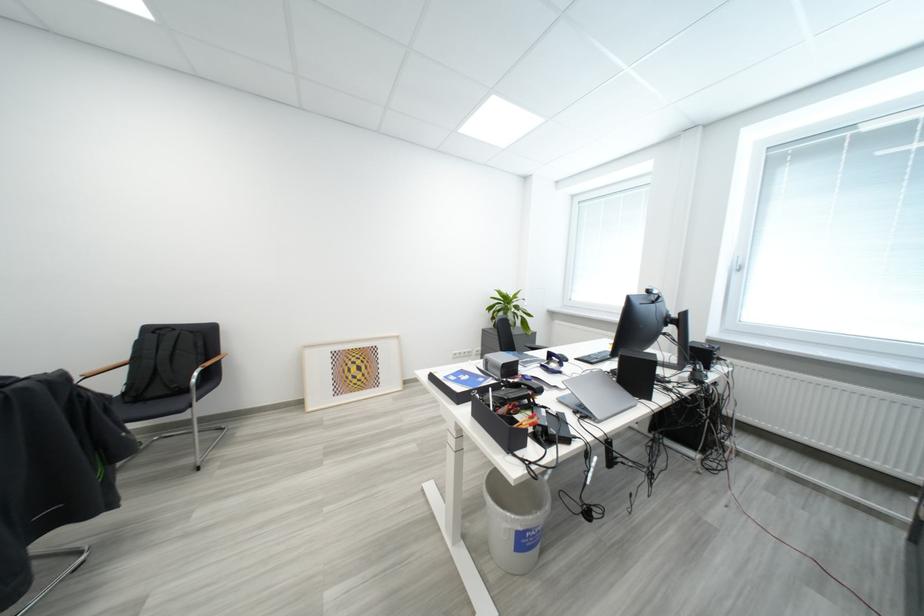
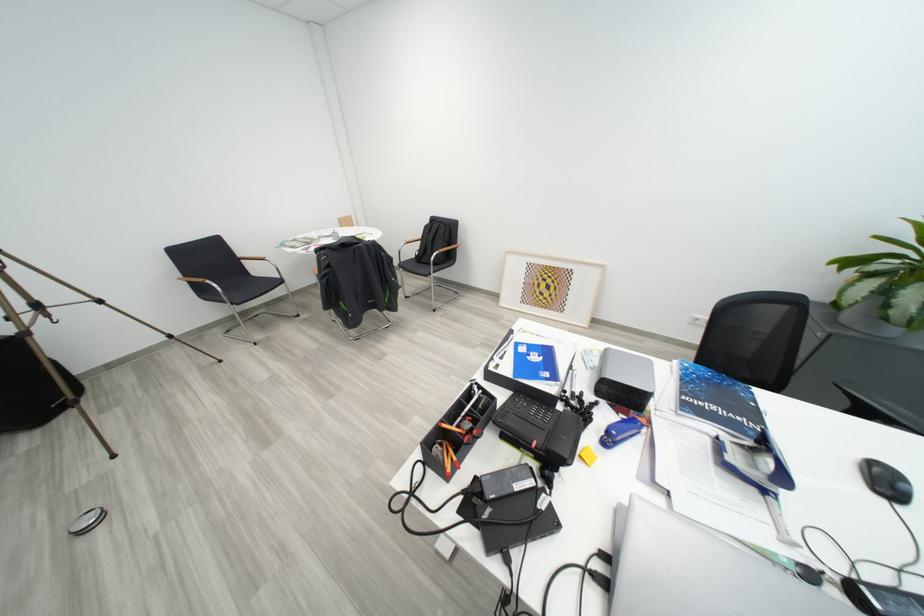
Locate, in the second image, the point that corresponds to (x=202, y=383) in the first image.

(442, 262)